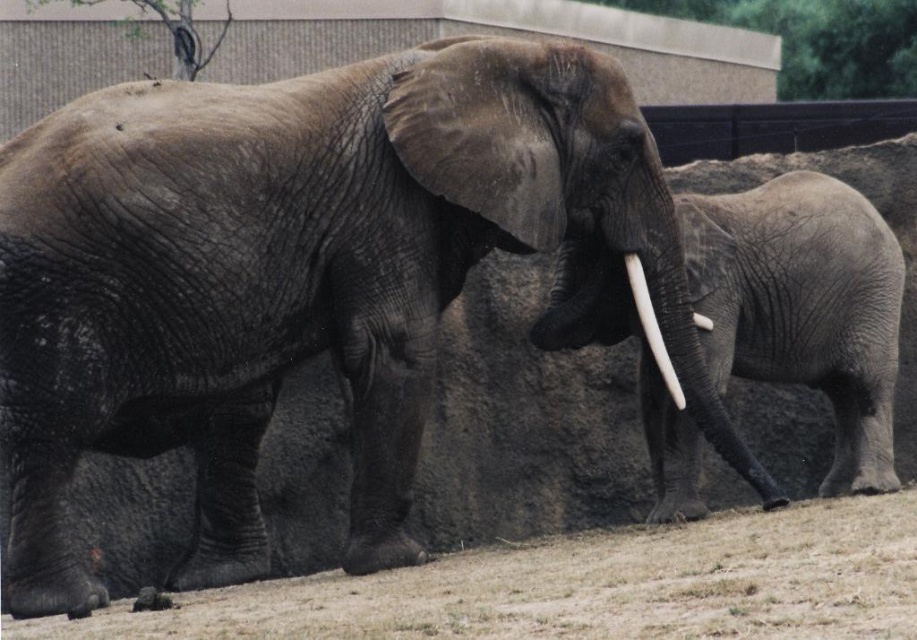
Question: Which of these objects is positioned farthest from the gray wrinkled skin elephant at right?

Choices:
 (A) white ivory tusk at center
 (B) white ivory tusk at right

Answer: (A)

Question: Is gray wrinkled skin elephant at right above white ivory tusk at center?

Choices:
 (A) yes
 (B) no

Answer: (B)

Question: Considering the relative positions of white ivory tusk at center and white ivory tusk at right in the image provided, where is white ivory tusk at center located with respect to white ivory tusk at right?

Choices:
 (A) right
 (B) left

Answer: (B)

Question: Which point is farther to the camera?

Choices:
 (A) (713, 257)
 (B) (672, 397)
 (C) (697, 326)

Answer: (A)

Question: Which of the following is the closest to the observer?

Choices:
 (A) white ivory tusk at right
 (B) gray wrinkled skin elephant at right
 (C) white ivory tusk at center

Answer: (C)

Question: Is white ivory tusk at center positioned behind white ivory tusk at right?

Choices:
 (A) yes
 (B) no

Answer: (B)